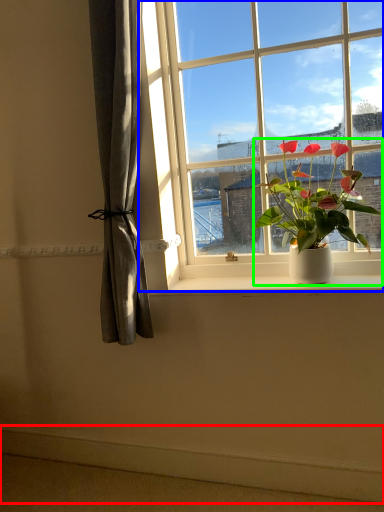
Question: Estimate the real-world distances between objects in this image. Which object is farther from ledge (highlighted by a red box), window (highlighted by a blue box) or houseplant (highlighted by a green box)?

Choices:
 (A) window
 (B) houseplant

Answer: (A)